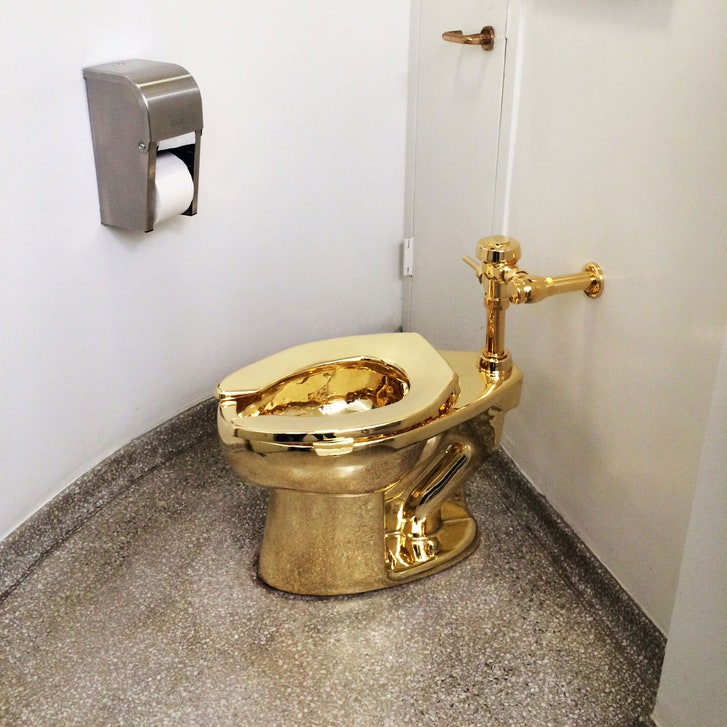
You are a GUI agent. You are given a task and a screenshot of the screen. Output one action in this format:
    pyautogui.click(x=<x>, y=<y>)
    Task: Click on the wall
    The height and width of the screenshot is (727, 727).
    Given the screenshot: What is the action you would take?
    pyautogui.click(x=267, y=169)